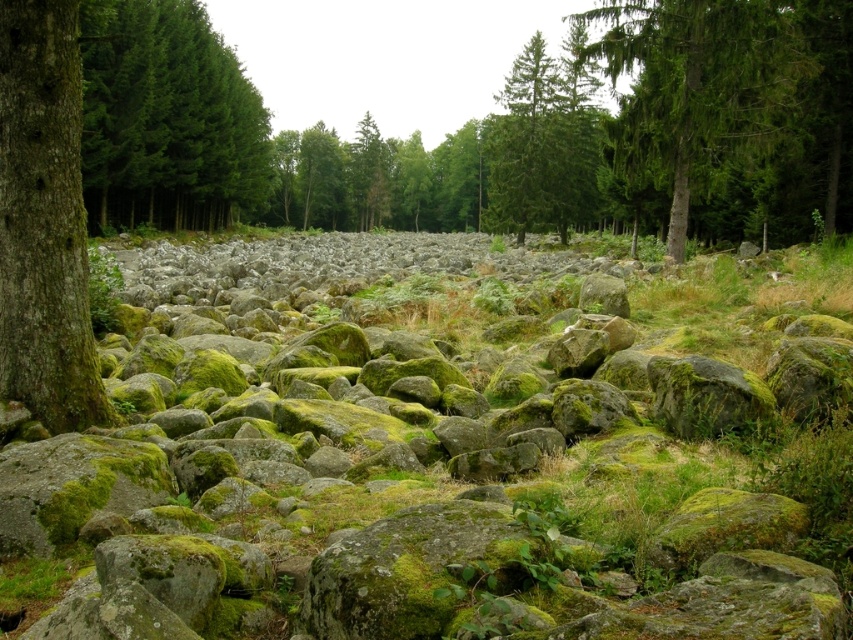
Question: Which point appears farthest from the camera in this image?

Choices:
 (A) (337, 198)
 (B) (105, 68)

Answer: (A)

Question: Does green mossy rocks at center have a smaller size compared to green mossy rock at center?

Choices:
 (A) yes
 (B) no

Answer: (A)

Question: Among these objects, which one is nearest to the camera?

Choices:
 (A) green mossy rock at center
 (B) green mossy bark tree at left
 (C) green leafy tree at center

Answer: (B)

Question: Does green mossy bark tree at left have a lesser width compared to green mossy tree at center?

Choices:
 (A) no
 (B) yes

Answer: (B)

Question: Among these objects, which one is farthest from the camera?

Choices:
 (A) green mossy rocks at center
 (B) green mossy rock at center
 (C) green matte tree at upper left

Answer: (B)

Question: Considering the relative positions of green matte tree at upper left and green mossy tree at center in the image provided, where is green matte tree at upper left located with respect to green mossy tree at center?

Choices:
 (A) right
 (B) left

Answer: (A)